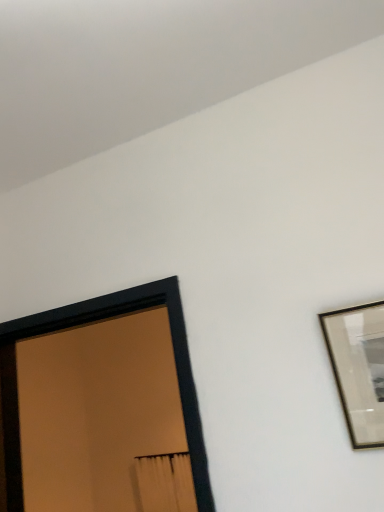
Where is `gold metallic picture frame at upper right, which is the second picture frame from left to right`? Image resolution: width=384 pixels, height=512 pixels. gold metallic picture frame at upper right, which is the second picture frame from left to right is located at coordinates (358, 369).

The width and height of the screenshot is (384, 512). What do you see at coordinates (358, 369) in the screenshot? I see `gold metallic picture frame at upper right, placed as the 1th picture frame when sorted from front to back` at bounding box center [358, 369].

The image size is (384, 512). Describe the element at coordinates (174, 354) in the screenshot. I see `black matte picture frame at left, the 2th picture frame positioned from the right` at that location.

What is the approximate width of black matte picture frame at left, the 2th picture frame positioned from the right?

It is 17.09 centimeters.

What are the coordinates of `black matte picture frame at left, marked as the first picture frame in a left-to-right arrangement` in the screenshot? It's located at (174, 354).

The image size is (384, 512). In order to click on gold metallic picture frame at upper right, which is the second picture frame from left to right in this screenshot , I will do `click(358, 369)`.

From the picture: Between black matte picture frame at left, arranged as the first picture frame when viewed from the back, and gold metallic picture frame at upper right, placed as the 1th picture frame when sorted from front to back, which one appears on the right side from the viewer's perspective?

From the viewer's perspective, gold metallic picture frame at upper right, placed as the 1th picture frame when sorted from front to back, appears more on the right side.

Relative to gold metallic picture frame at upper right, which is the first picture frame from right to left, is black matte picture frame at left, marked as the first picture frame in a left-to-right arrangement, in front or behind?

black matte picture frame at left, marked as the first picture frame in a left-to-right arrangement, is positioned farther from the viewer than gold metallic picture frame at upper right, which is the first picture frame from right to left.

Which is in front, point (206, 483) or point (369, 374)?

The point (369, 374) is more forward.

In the scene shown: From the image's perspective, is black matte picture frame at left, the 2th picture frame positioned from the right, positioned above or below gold metallic picture frame at upper right, placed as the 1th picture frame when sorted from front to back?

Clearly, from the image's perspective, black matte picture frame at left, the 2th picture frame positioned from the right, is below gold metallic picture frame at upper right, placed as the 1th picture frame when sorted from front to back.

From a real-world perspective, is black matte picture frame at left, the 2th picture frame positioned from the right, above or below gold metallic picture frame at upper right, which is the first picture frame from right to left?

In terms of real-world spatial position, black matte picture frame at left, the 2th picture frame positioned from the right, is above gold metallic picture frame at upper right, which is the first picture frame from right to left.

Can you confirm if black matte picture frame at left, arranged as the first picture frame when viewed from the back, is thinner than gold metallic picture frame at upper right, the second picture frame positioned from the back?

No, black matte picture frame at left, arranged as the first picture frame when viewed from the back, is not thinner than gold metallic picture frame at upper right, the second picture frame positioned from the back.

Does black matte picture frame at left, marked as the first picture frame in a left-to-right arrangement, have a greater height compared to gold metallic picture frame at upper right, which is the first picture frame from right to left?

Yes, black matte picture frame at left, marked as the first picture frame in a left-to-right arrangement, is taller than gold metallic picture frame at upper right, which is the first picture frame from right to left.

Is black matte picture frame at left, marked as the first picture frame in a left-to-right arrangement, smaller than gold metallic picture frame at upper right, which is the second picture frame from left to right?

Incorrect, black matte picture frame at left, marked as the first picture frame in a left-to-right arrangement, is not smaller in size than gold metallic picture frame at upper right, which is the second picture frame from left to right.

Is black matte picture frame at left, arranged as the first picture frame when viewed from the back, positioned beyond the bounds of gold metallic picture frame at upper right, the second picture frame positioned from the back?

That's correct, black matte picture frame at left, arranged as the first picture frame when viewed from the back, is outside of gold metallic picture frame at upper right, the second picture frame positioned from the back.

Are black matte picture frame at left, which is counted as the second picture frame, starting from the front, and gold metallic picture frame at upper right, the second picture frame positioned from the back, located far from each other?

black matte picture frame at left, which is counted as the second picture frame, starting from the front, is actually quite close to gold metallic picture frame at upper right, the second picture frame positioned from the back.

Could you tell me if black matte picture frame at left, marked as the first picture frame in a left-to-right arrangement, is facing gold metallic picture frame at upper right, the second picture frame positioned from the back?

No.

Can you tell me how much black matte picture frame at left, marked as the first picture frame in a left-to-right arrangement, and gold metallic picture frame at upper right, placed as the 1th picture frame when sorted from front to back, differ in facing direction?

The angle between the facing direction of black matte picture frame at left, marked as the first picture frame in a left-to-right arrangement, and the facing direction of gold metallic picture frame at upper right, placed as the 1th picture frame when sorted from front to back, is 0.819 degrees.

The image size is (384, 512). Identify the location of picture frame lying in front of the black matte picture frame at left, the 2th picture frame positioned from the right. (358, 369).

In the scene shown: Which object is positioned more to the right, gold metallic picture frame at upper right, which is the first picture frame from right to left, or black matte picture frame at left, arranged as the first picture frame when viewed from the back?

gold metallic picture frame at upper right, which is the first picture frame from right to left, is more to the right.

Based on the photo, is gold metallic picture frame at upper right, which is the first picture frame from right to left, further to camera compared to black matte picture frame at left, which is counted as the second picture frame, starting from the front?

No, it is not.

Is point (352, 371) farther from viewer compared to point (96, 309)?

No, (352, 371) is in front of (96, 309).

From the image's perspective, which object appears higher, gold metallic picture frame at upper right, the second picture frame positioned from the back, or black matte picture frame at left, which is counted as the second picture frame, starting from the front?

From the image's view, gold metallic picture frame at upper right, the second picture frame positioned from the back, is above.

From a real-world perspective, which object rests below the other?

In real-world perspective, gold metallic picture frame at upper right, the second picture frame positioned from the back, is lower.

Considering the sizes of objects gold metallic picture frame at upper right, which is the second picture frame from left to right, and black matte picture frame at left, arranged as the first picture frame when viewed from the back, in the image provided, who is thinner, gold metallic picture frame at upper right, which is the second picture frame from left to right, or black matte picture frame at left, arranged as the first picture frame when viewed from the back,?

gold metallic picture frame at upper right, which is the second picture frame from left to right, is thinner.

Who is taller, gold metallic picture frame at upper right, which is the first picture frame from right to left, or black matte picture frame at left, marked as the first picture frame in a left-to-right arrangement?

black matte picture frame at left, marked as the first picture frame in a left-to-right arrangement, is taller.

Does gold metallic picture frame at upper right, which is the second picture frame from left to right, have a smaller size compared to black matte picture frame at left, arranged as the first picture frame when viewed from the back?

Correct, gold metallic picture frame at upper right, which is the second picture frame from left to right, occupies less space than black matte picture frame at left, arranged as the first picture frame when viewed from the back.

Looking at this image, is gold metallic picture frame at upper right, the second picture frame positioned from the back, inside or outside of black matte picture frame at left, marked as the first picture frame in a left-to-right arrangement?

gold metallic picture frame at upper right, the second picture frame positioned from the back, is located beyond the bounds of black matte picture frame at left, marked as the first picture frame in a left-to-right arrangement.

Are gold metallic picture frame at upper right, which is the second picture frame from left to right, and black matte picture frame at left, arranged as the first picture frame when viewed from the back, far apart?

No, gold metallic picture frame at upper right, which is the second picture frame from left to right, is in close proximity to black matte picture frame at left, arranged as the first picture frame when viewed from the back.

Could you tell me if gold metallic picture frame at upper right, which is the second picture frame from left to right, is facing black matte picture frame at left, arranged as the first picture frame when viewed from the back?

No, gold metallic picture frame at upper right, which is the second picture frame from left to right, is not aimed at black matte picture frame at left, arranged as the first picture frame when viewed from the back.

Can you tell me how much gold metallic picture frame at upper right, the second picture frame positioned from the back, and black matte picture frame at left, arranged as the first picture frame when viewed from the back, differ in facing direction?

The facing directions of gold metallic picture frame at upper right, the second picture frame positioned from the back, and black matte picture frame at left, arranged as the first picture frame when viewed from the back, are 0.819 degrees apart.

How far apart are gold metallic picture frame at upper right, placed as the 1th picture frame when sorted from front to back, and black matte picture frame at left, which is counted as the second picture frame, starting from the front?

The distance of gold metallic picture frame at upper right, placed as the 1th picture frame when sorted from front to back, from black matte picture frame at left, which is counted as the second picture frame, starting from the front, is 21.98 inches.

At what (x,y) coordinates should I click in order to perform the action: click on picture frame on the right of black matte picture frame at left, which is counted as the second picture frame, starting from the front. Please return your answer as a coordinate pair (x, y). The image size is (384, 512). Looking at the image, I should click on (358, 369).

You are a GUI agent. You are given a task and a screenshot of the screen. Output one action in this format:
    pyautogui.click(x=<x>, y=<y>)
    Task: Click on the picture frame located in front of the black matte picture frame at left, marked as the first picture frame in a left-to-right arrangement
    Image resolution: width=384 pixels, height=512 pixels.
    Given the screenshot: What is the action you would take?
    pyautogui.click(x=358, y=369)

Where is `picture frame below the black matte picture frame at left, which is counted as the second picture frame, starting from the front (from a real-world perspective)`? picture frame below the black matte picture frame at left, which is counted as the second picture frame, starting from the front (from a real-world perspective) is located at coordinates (358, 369).